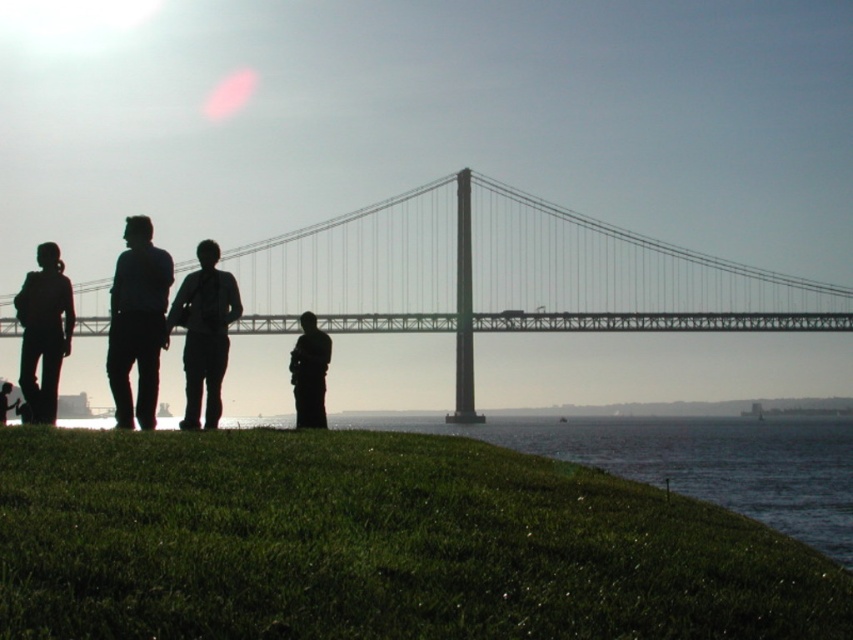
Question: Is matte black shirt at left bigger than silhouette figure at lower left?

Choices:
 (A) yes
 (B) no

Answer: (A)

Question: Does green grassy hill at lower center appear under metallic gray bridge at center?

Choices:
 (A) yes
 (B) no

Answer: (A)

Question: Which of the following is the closest to the observer?

Choices:
 (A) (27, 371)
 (B) (477, 250)
 (C) (195, 305)
 (D) (311, 387)

Answer: (A)

Question: Among these points, which one is nearest to the camera?

Choices:
 (A) (428, 308)
 (B) (192, 388)
 (C) (33, 352)
 (D) (315, 355)

Answer: (C)

Question: Does silhouette clothing at center lie in front of matte black shirt at left?

Choices:
 (A) yes
 (B) no

Answer: (A)

Question: Which point is farther to the camera?

Choices:
 (A) matte black shirt at left
 (B) dark matte figure at center

Answer: (B)